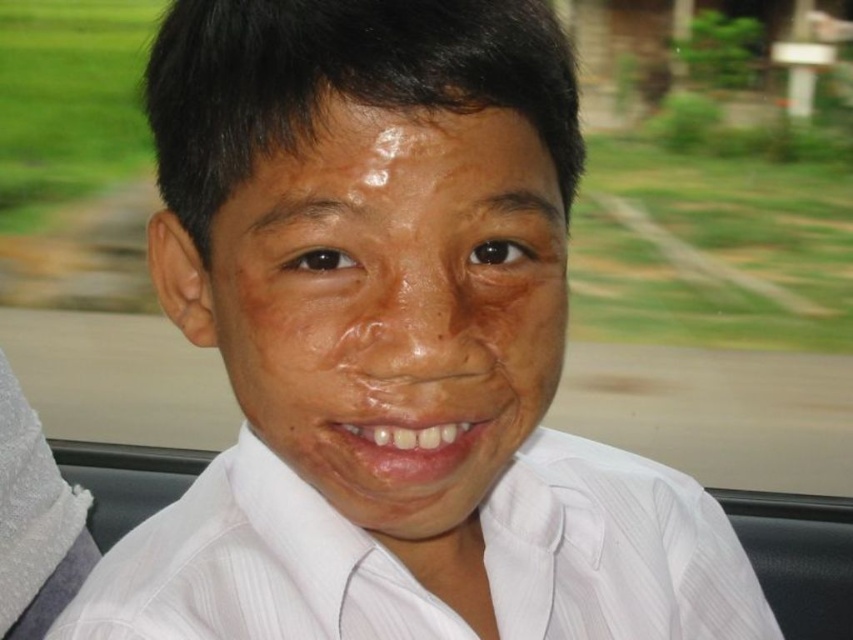
How far apart are white striped dress shirt at center and dry skin at center?

white striped dress shirt at center is 18.90 centimeters away from dry skin at center.

Is white striped dress shirt at center taller than dry skin at center?

Indeed, white striped dress shirt at center has a greater height compared to dry skin at center.

Is point (286, 513) positioned before point (479, 152)?

No.

The image size is (853, 640). Identify the location of white striped dress shirt at center. (252, 568).

Is smooth skin face at center to the left of dry skin at center from the viewer's perspective?

Indeed, smooth skin face at center is positioned on the left side of dry skin at center.

Can you confirm if smooth skin face at center is shorter than dry skin at center?

No, smooth skin face at center is not shorter than dry skin at center.

The image size is (853, 640). I want to click on smooth skin face at center, so click(393, 307).

Locate an element on the screen. smooth skin face at center is located at coordinates (393, 307).

Who is higher up, smooth skin face at center or white striped dress shirt at center?

Positioned higher is smooth skin face at center.

From the picture: Between smooth skin face at center and white striped dress shirt at center, which one has less height?

Standing shorter between the two is white striped dress shirt at center.

Who is more forward, (346, 371) or (236, 468)?

Point (346, 371) is in front.

Locate an element on the screen. This screenshot has width=853, height=640. smooth skin face at center is located at coordinates (393, 307).